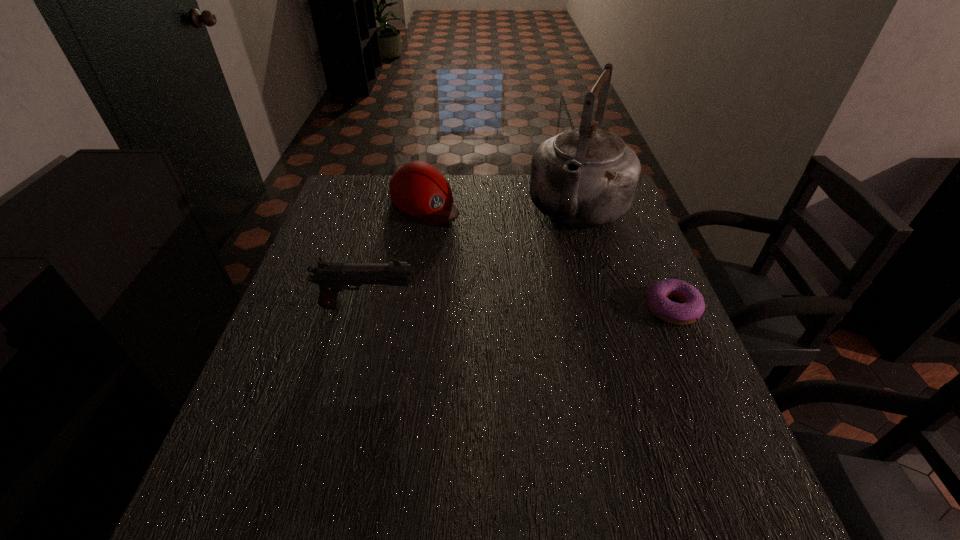
Find the location of a particular element. vacant space on the desktop that is between the second tallest object and the shortest object and is positioned on the front-facing side of the baseball cap is located at coordinates (538, 307).

Identify the location of vacant space on the desktop that is between the second tallest object and the doughnut and is positioned at the spout of the tallest object. (537, 307).